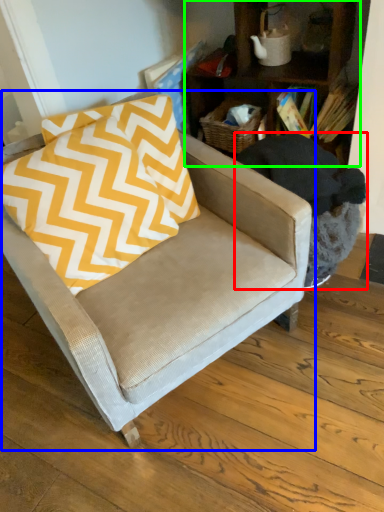
Question: Which object is the farthest from swivel chair (highlighted by a red box)? Choose among these: chair (highlighted by a blue box) or bookcase (highlighted by a green box).

Choices:
 (A) chair
 (B) bookcase

Answer: (B)